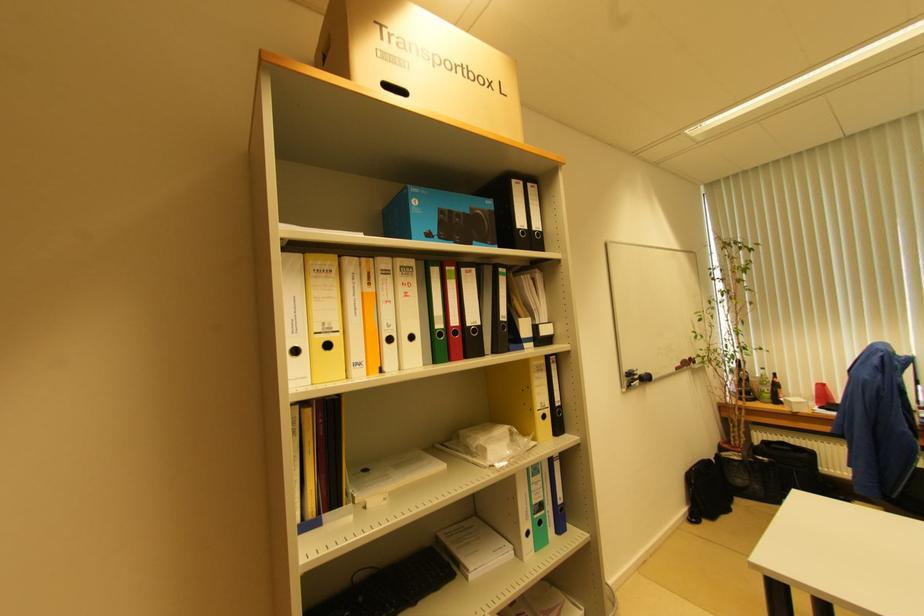
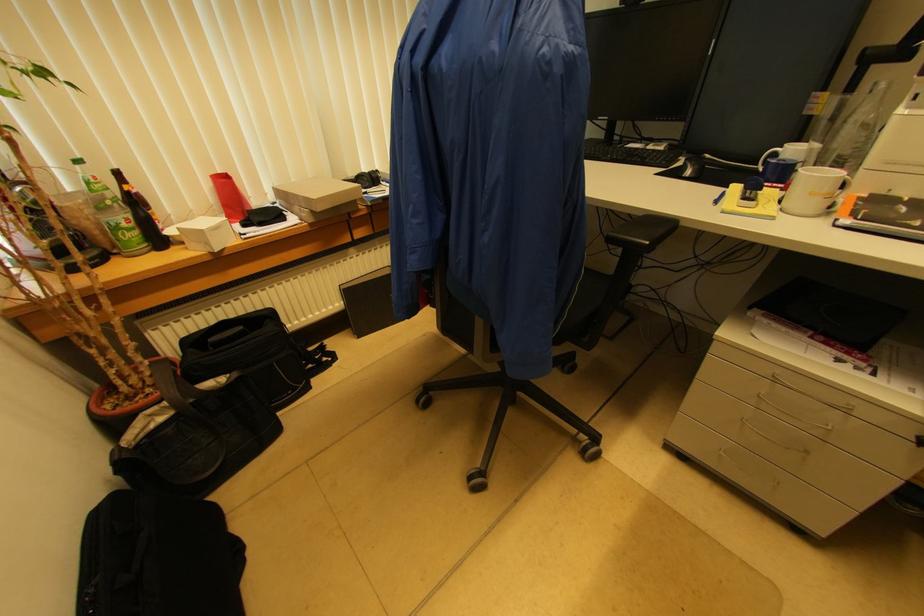
In the second image, find the point that corresponds to point (772, 392) in the first image.

(131, 219)